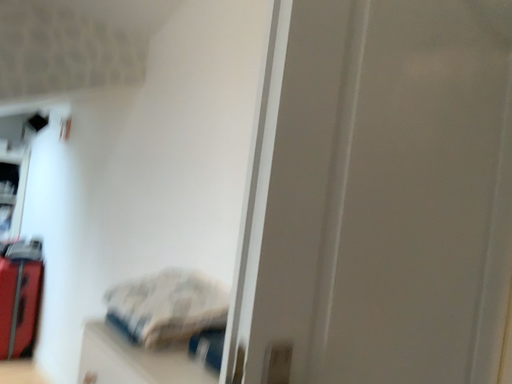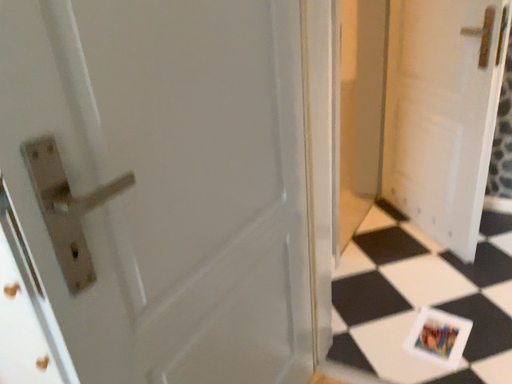
Question: Which way did the camera rotate in the video?

Choices:
 (A) rotated right
 (B) rotated left

Answer: (A)